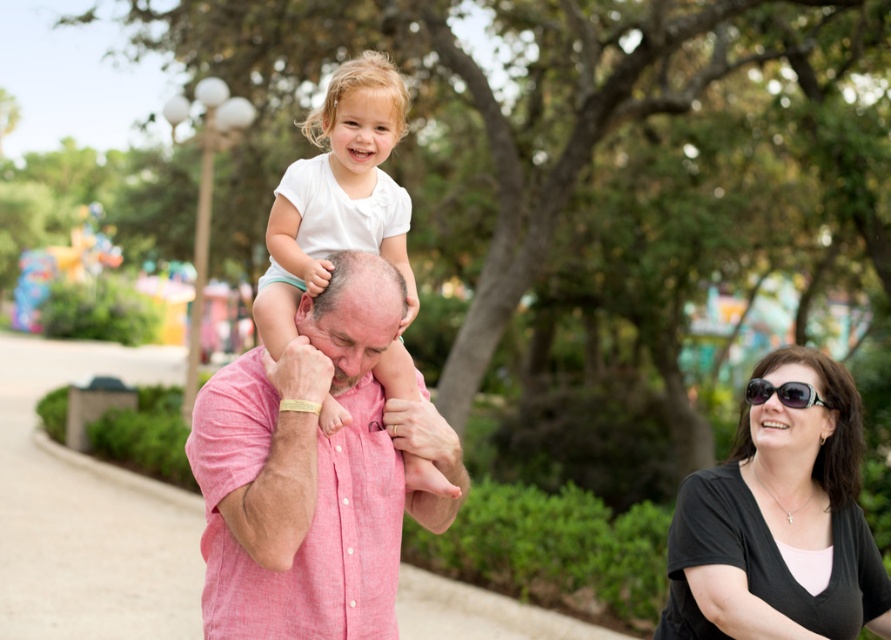
Is pink linen shirt at center to the left of black plastic sunglasses at lower right from the viewer's perspective?

Correct, you'll find pink linen shirt at center to the left of black plastic sunglasses at lower right.

Does pink linen shirt at center have a smaller size compared to black plastic sunglasses at lower right?

Actually, pink linen shirt at center might be larger than black plastic sunglasses at lower right.

The width and height of the screenshot is (891, 640). Describe the element at coordinates (313, 474) in the screenshot. I see `pink linen shirt at center` at that location.

Identify the location of pink linen shirt at center. The height and width of the screenshot is (640, 891). (313, 474).

Between point (754, 541) and point (419, 467), which one is positioned behind?

Positioned behind is point (419, 467).

Who is shorter, black matte shirt at lower right or white cotton shirt at center?

black matte shirt at lower right is shorter.

Locate an element on the screen. The height and width of the screenshot is (640, 891). black matte shirt at lower right is located at coordinates (778, 518).

The height and width of the screenshot is (640, 891). I want to click on black matte shirt at lower right, so click(x=778, y=518).

Is black matte shirt at lower right thinner than black plastic sunglasses at lower right?

No.

Does black matte shirt at lower right have a greater width compared to black plastic sunglasses at lower right?

Yes, black matte shirt at lower right is wider than black plastic sunglasses at lower right.

Where is `black matte shirt at lower right`? The image size is (891, 640). black matte shirt at lower right is located at coordinates (778, 518).